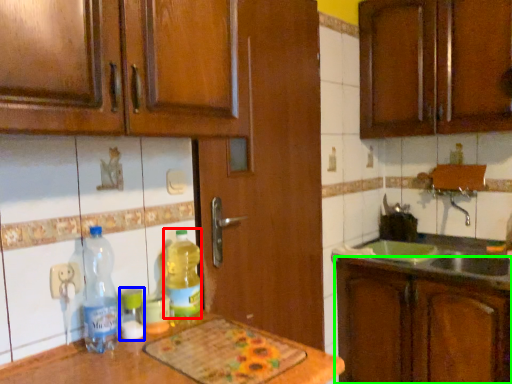
Question: Considering the real-world distances, which object is farthest from bottle (highlighted by a red box)? bottle (highlighted by a blue box) or cabinetry (highlighted by a green box)?

Choices:
 (A) bottle
 (B) cabinetry

Answer: (B)